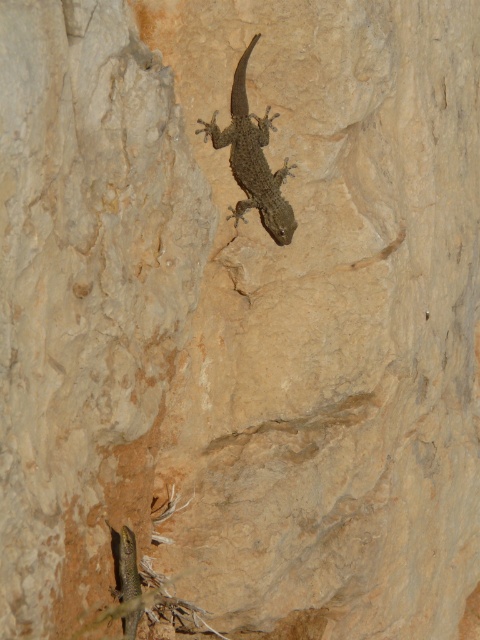
Which of these two, smooth brown lizard at center or green scaly lizard at lower left, stands taller?

smooth brown lizard at center is taller.

Between smooth brown lizard at center and green scaly lizard at lower left, which one appears on the right side from the viewer's perspective?

From the viewer's perspective, smooth brown lizard at center appears more on the right side.

Does point (233, 172) come closer to viewer compared to point (130, 618)?

No, (233, 172) is further to viewer.

I want to click on smooth brown lizard at center, so click(x=252, y=160).